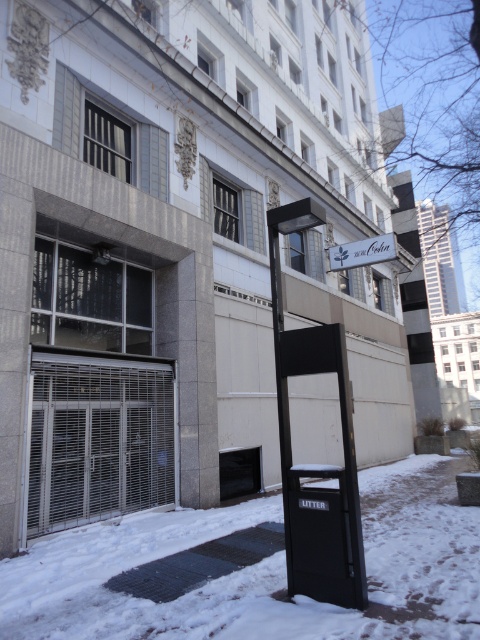
You are a city planner assessing the layout of this urban area. You need to determine if the white powdery snow at lower left and the white matte sign at upper center can both fit within a standard 2m wide pathway. Based on their widths, what is your conclusion?

The white powdery snow at lower left is wider than the white matte sign at upper center. Since the pathway is 2m wide, both objects can fit as their combined width would not exceed the pathway width unless they are placed side by side. However, if they are positioned along the same axis, the snow might occupy more space. Further details on their exact positions are needed for an accurate assessment.

You are standing in the winter scene and want to place a small snowman using the white powdery snow at lower left. If you look up towards the white matte sign at upper center, will the snowman be to the left or right of the sign?

The white powdery snow at lower left is to the left of the white matte sign at upper center, so the snowman made from the snow will also be positioned to the left of the sign.

You are a delivery person trying to locate the entrance to the building. You see the white powdery snow at lower left and the white matte sign at upper center. Which object is closer to you?

The white powdery snow at lower left is closer to you because it is in front of the white matte sign at upper center.